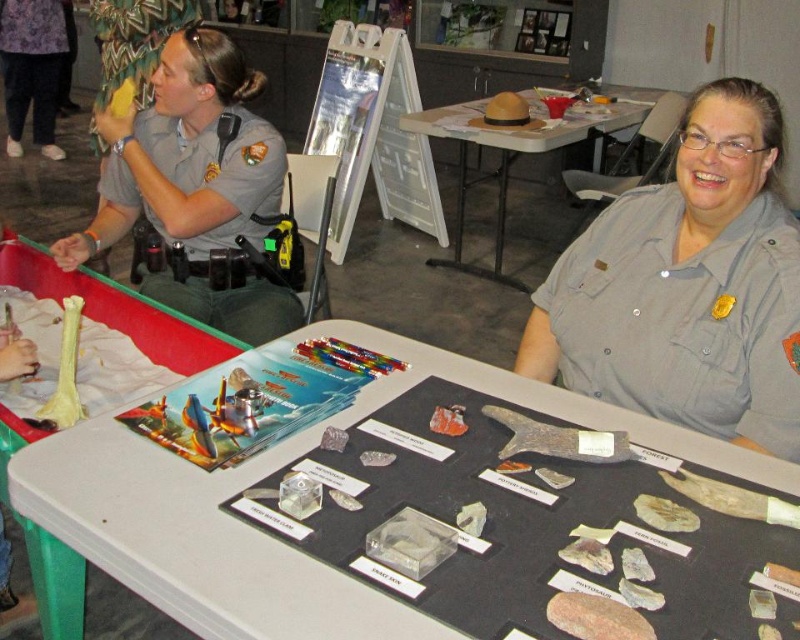
Question: Which object is closer to the camera taking this photo?

Choices:
 (A) gray uniform at center
 (B) translucent glass bone at lower left

Answer: (B)

Question: Can you confirm if matte gray uniform at left is smaller than wooden folding table at upper center?

Choices:
 (A) no
 (B) yes

Answer: (B)

Question: Where is gray uniform at center located in relation to white plastic table at left in the image?

Choices:
 (A) right
 (B) left

Answer: (A)

Question: Observing the image, what is the correct spatial positioning of white plastic table at left in reference to purple fabric pants at upper left?

Choices:
 (A) right
 (B) left

Answer: (A)

Question: Estimate the real-world distances between objects in this image. Which object is farther from the wooden folding table at upper center?

Choices:
 (A) gray uniform at center
 (B) matte gray uniform at left
 (C) translucent glass bone at lower left

Answer: (C)

Question: Among these points, which one is nearest to the camera?

Choices:
 (A) (56, 557)
 (B) (2, 42)
 (C) (532, 106)

Answer: (A)